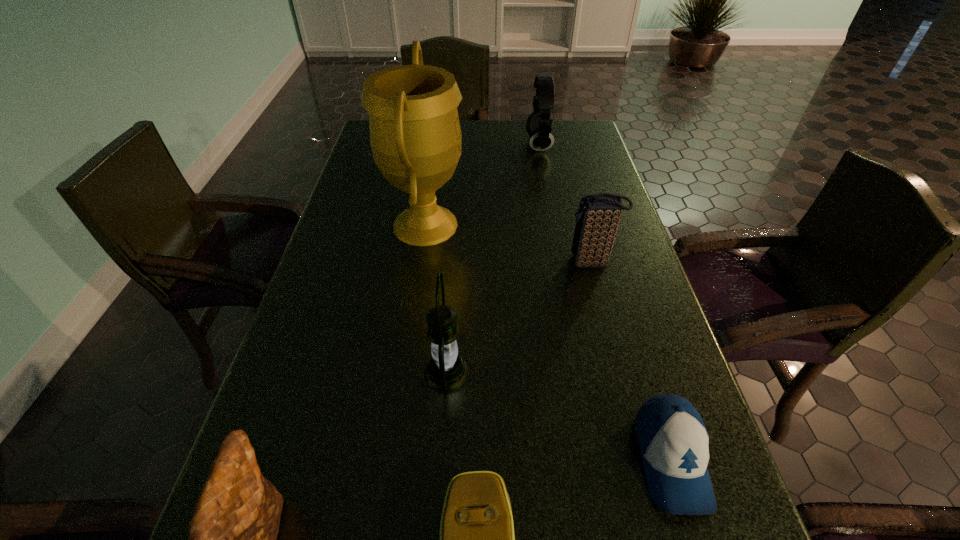
The image size is (960, 540). In order to click on blank space at the far edge of the desktop in this screenshot , I will do `click(507, 137)`.

The width and height of the screenshot is (960, 540). In the image, there is a desktop. Find the location of `vacant region at the left edge`. vacant region at the left edge is located at coordinates (300, 450).

Find the location of `vacant area at the right edge`. vacant area at the right edge is located at coordinates (638, 265).

Image resolution: width=960 pixels, height=540 pixels. I want to click on free space at the far right corner of the desktop, so click(568, 123).

Where is `vacant point located between the baseball cap and the rightmost clutch bag`? Image resolution: width=960 pixels, height=540 pixels. vacant point located between the baseball cap and the rightmost clutch bag is located at coordinates tap(631, 361).

Find the location of a particular element. This screenshot has height=540, width=960. free space between the farthest object and the trophy is located at coordinates (482, 185).

Where is `vacant space that's between the baseball cap and the farthest clutch bag`? vacant space that's between the baseball cap and the farthest clutch bag is located at coordinates tap(631, 361).

Find the location of a particular element. The width and height of the screenshot is (960, 540). object that is the third closest to the farthest object is located at coordinates (446, 372).

The height and width of the screenshot is (540, 960). I want to click on object that is the sixth closest to the shortest clutch bag, so click(538, 125).

At what (x,y) coordinates should I click in order to perform the action: click on clutch bag that can be found as the second closest to the baseball cap. Please return your answer as a coordinate pair (x, y). Looking at the image, I should click on (598, 217).